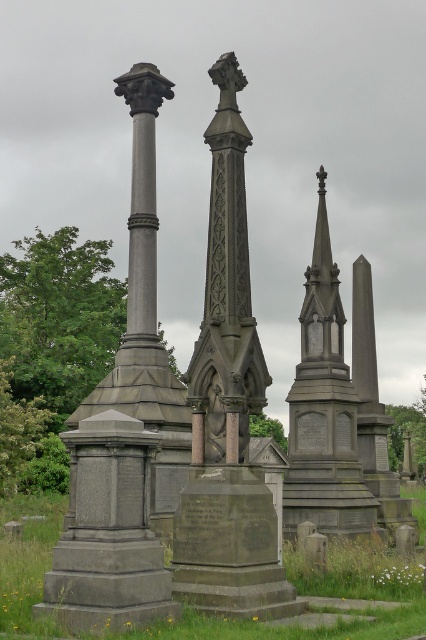
Question: Can you confirm if gray stone monument at center is smaller than polished stone spire at center?

Choices:
 (A) no
 (B) yes

Answer: (B)

Question: Considering the relative positions of gray stone monument at center and polished stone spire at center in the image provided, where is gray stone monument at center located with respect to polished stone spire at center?

Choices:
 (A) below
 (B) above

Answer: (B)

Question: Which point appears farthest from the camera in this image?

Choices:
 (A) (345, 525)
 (B) (221, 70)

Answer: (A)

Question: Which object is closer to the camera taking this photo?

Choices:
 (A) polished stone spire at center
 (B) gray stone monument at center

Answer: (B)

Question: From the image, what is the correct spatial relationship of gray stone monument at center in relation to polished stone spire at center?

Choices:
 (A) left
 (B) right

Answer: (A)